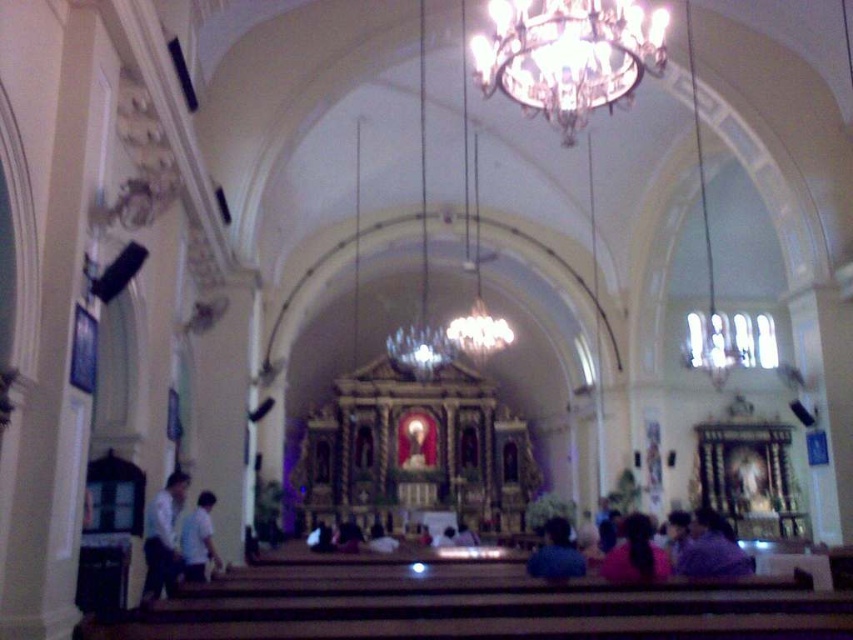
You are standing in the church and want to take a photo of the crystal glass chandelier at upper center and the dark purple fabric at center. Which object should you focus on first to ensure both are in the frame?

You should focus on the crystal glass chandelier at upper center first because it is closer to you than the dark purple fabric at center, so adjusting the camera to include it will also capture the fabric behind it.

You are standing in the church and want to locate the purple matte shirt at lower right. According to the coordinates provided, where should you look?

The purple matte shirt at lower right is located at point (711, 548).